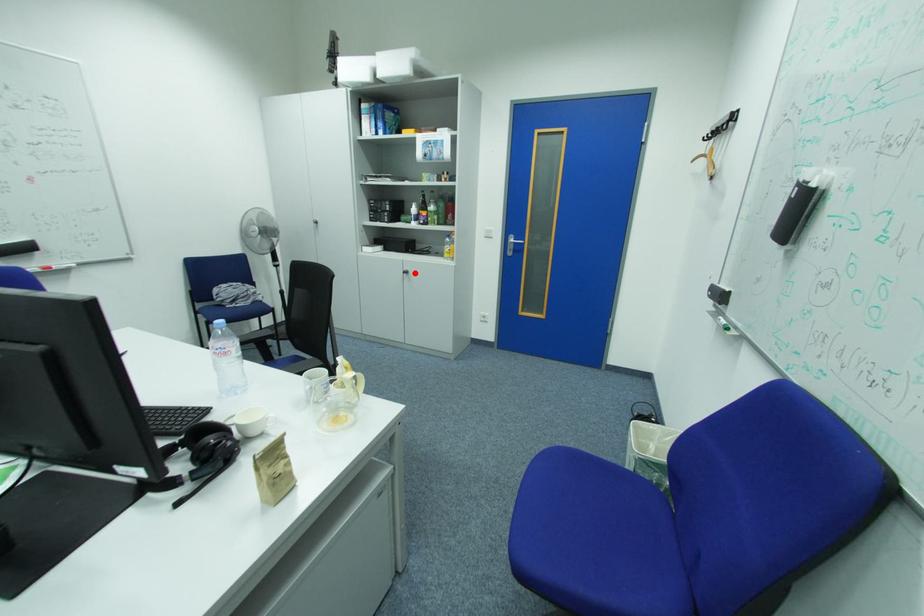
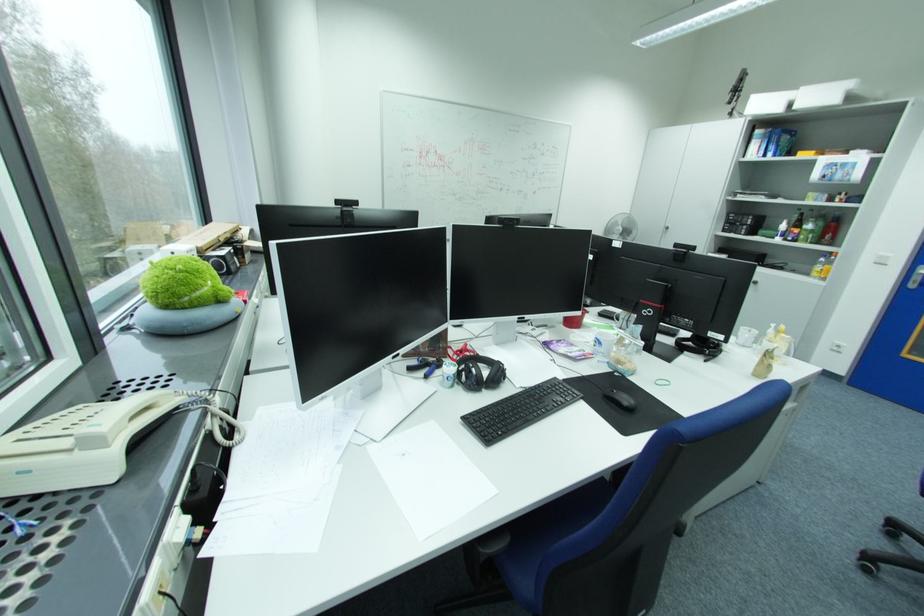
Find the pixel in the second image that matches the highlighted location in the first image.

(763, 283)